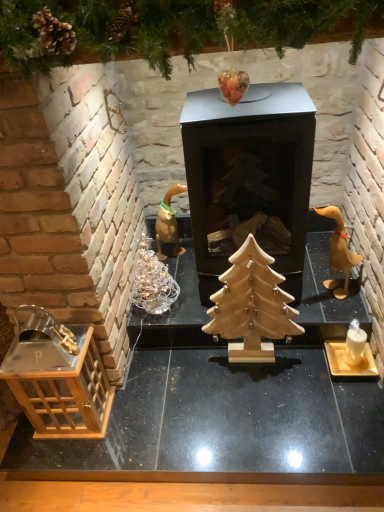
What are the coordinates of `vacant space in between matte gold candle holder at lower right and transparent glass lantern at lower left` in the screenshot? It's located at (209, 395).